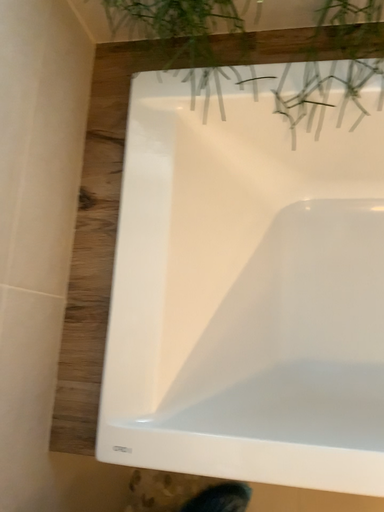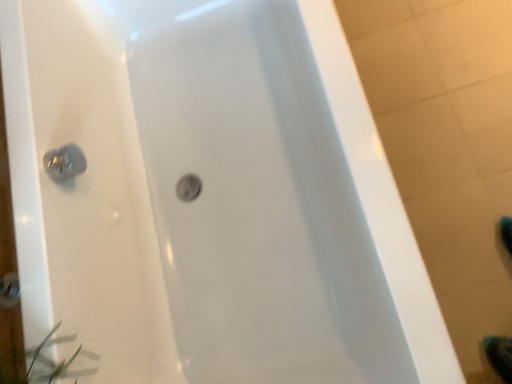
Question: How did the camera likely rotate when shooting the video?

Choices:
 (A) rotated downward
 (B) rotated upward

Answer: (B)